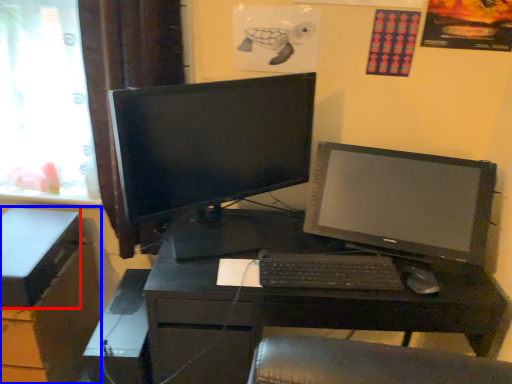
Question: Which point is further to the camera, box (highlighted by a red box) or file cabinet (highlighted by a blue box)?

Choices:
 (A) box
 (B) file cabinet

Answer: (B)